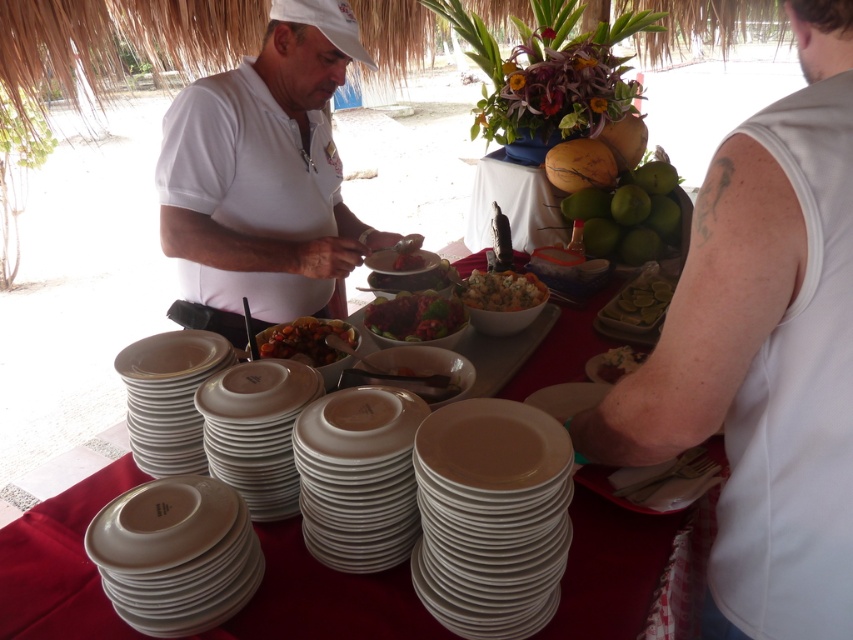
Is green matte limes at center-right behind shiny red salad at center?

Yes, green matte limes at center-right is further from the viewer.

Can you confirm if green matte limes at center-right is positioned below shiny red salad at center?

Incorrect, green matte limes at center-right is not positioned below shiny red salad at center.

Locate an element on the screen. green matte limes at center-right is located at coordinates (628, 212).

Is white glossy plate at lower center to the right of green matte limes at center-right from the viewer's perspective?

In fact, white glossy plate at lower center is to the left of green matte limes at center-right.

Between white glossy plate at lower center and green matte limes at center-right, which one appears on the right side from the viewer's perspective?

Positioned to the right is green matte limes at center-right.

Find the location of a particular element. The width and height of the screenshot is (853, 640). white glossy plate at lower center is located at coordinates (x=491, y=516).

Can you confirm if white glossy plates at center is bigger than shiny red salad at center?

Yes, white glossy plates at center is bigger than shiny red salad at center.

Does white glossy plates at center have a greater height compared to shiny red salad at center?

Yes.

What do you see at coordinates (59, 564) in the screenshot?
I see `white glossy plates at center` at bounding box center [59, 564].

Locate an element on the screen. The width and height of the screenshot is (853, 640). white glossy plates at center is located at coordinates (59, 564).